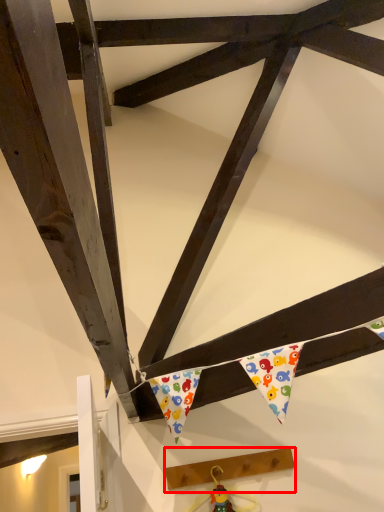
Question: Considering the relative positions of plank (annotated by the red box) and toy in the image provided, where is plank (annotated by the red box) located with respect to the staircase?

Choices:
 (A) right
 (B) left

Answer: (A)